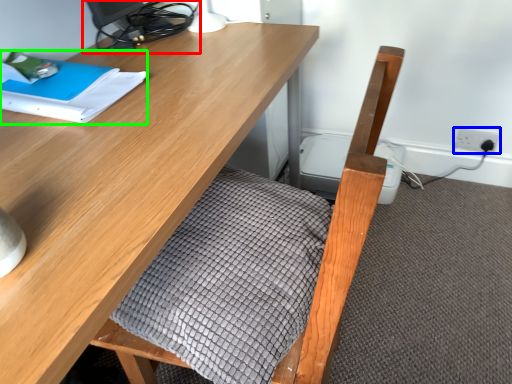
Question: Estimate the real-world distances between objects in this image. Which object is closer to desktop (highlighted by a red box), electric outlet (highlighted by a blue box) or notebook (highlighted by a green box)?

Choices:
 (A) electric outlet
 (B) notebook

Answer: (B)